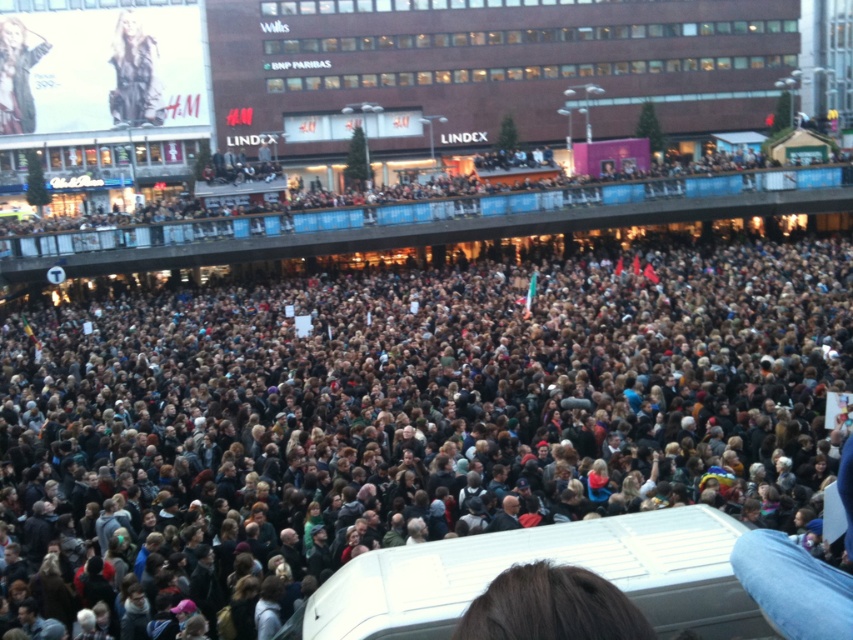
Is dark brown hair at center smaller than metallic silver figure at upper left?

No.

Who is taller, dark brown hair at center or metallic silver figure at upper left?

With more height is dark brown hair at center.

Describe the element at coordinates (426, 397) in the screenshot. I see `dark brown hair at center` at that location.

What are the coordinates of `dark brown hair at center` in the screenshot? It's located at (426, 397).

Between metallic silver figure at upper left and matte black jacket at upper left, which one is positioned higher?

Positioned higher is metallic silver figure at upper left.

Between metallic silver figure at upper left and matte black jacket at upper left, which one appears on the right side from the viewer's perspective?

metallic silver figure at upper left is more to the right.

Who is more distant from viewer, (128, 106) or (41, 48)?

The point (128, 106) is behind.

Where is `metallic silver figure at upper left`? The image size is (853, 640). metallic silver figure at upper left is located at coordinates (134, 76).

Between point (556, 264) and point (20, 32), which one is positioned behind?

Positioned behind is point (20, 32).

Is point (728, 438) in front of point (0, 113)?

Yes, it is.

This screenshot has width=853, height=640. In order to click on dark brown hair at center in this screenshot , I will do `click(426, 397)`.